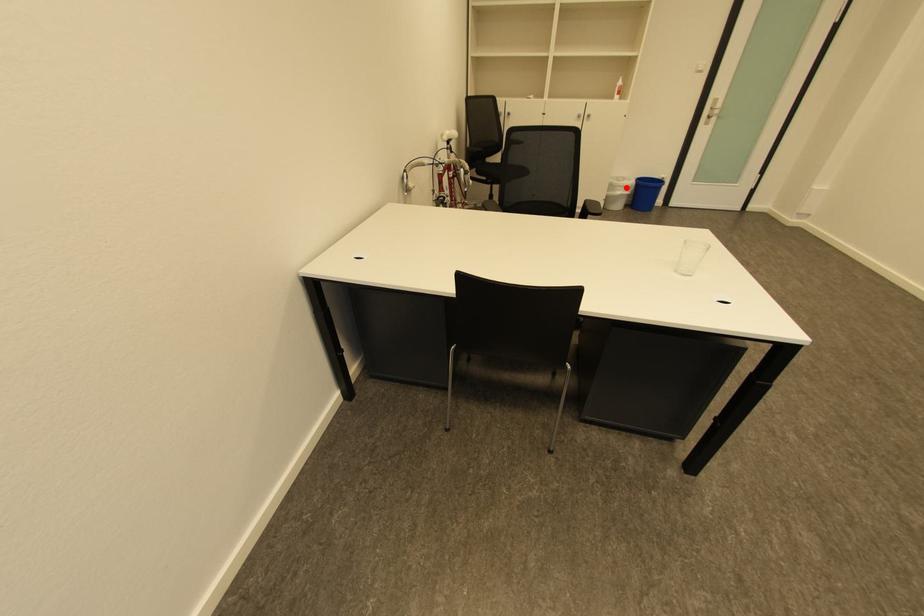
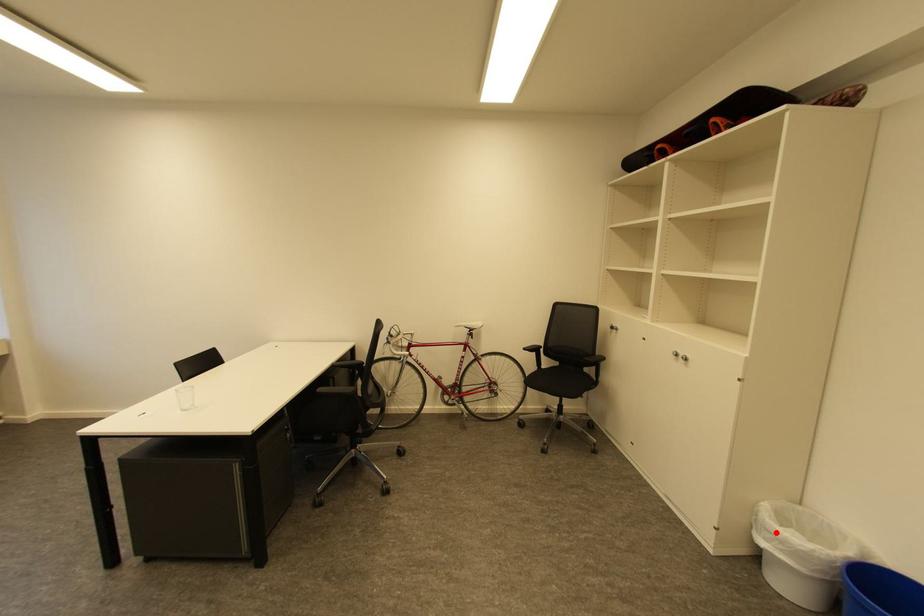
I am providing you with two images of the same scene from different viewpoints. A red point is marked on the first image and another point is marked on the second image. Do the highlighted points in image1 and image2 indicate the same real-world spot?

Yes